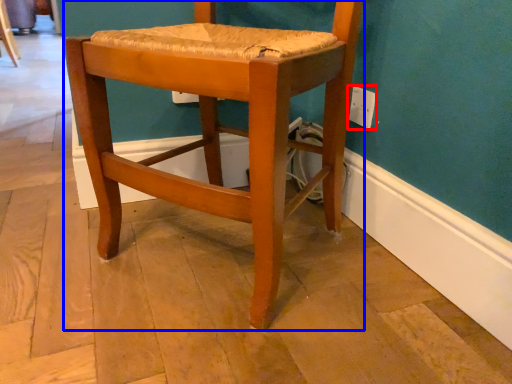
Question: Which point is closer to the camera, electric outlet (highlighted by a red box) or chair (highlighted by a blue box)?

Choices:
 (A) electric outlet
 (B) chair

Answer: (B)